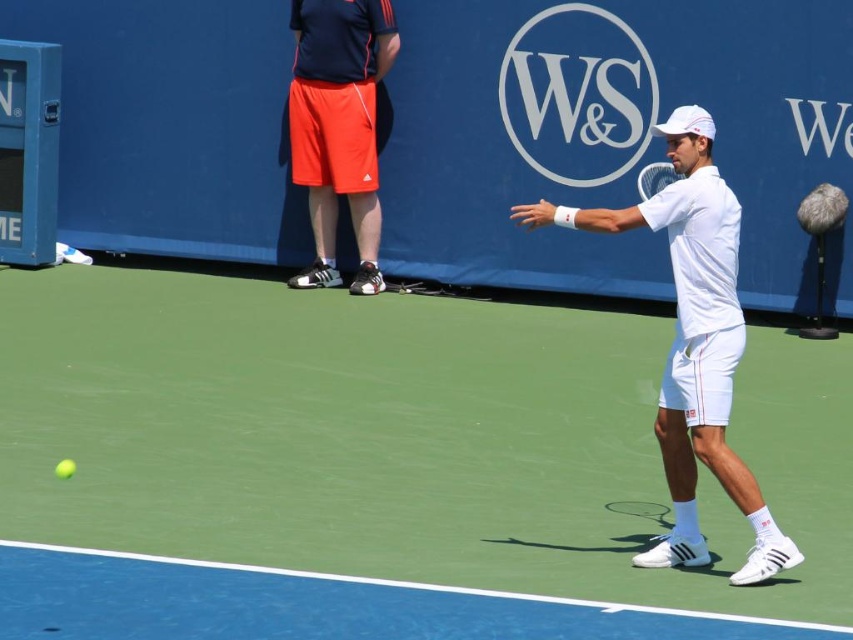
You are a tennis coach observing the match and want to analyze the players. Which racket is taller, the white matte tennis racket at right or the white matte tennis racket at center?

The white matte tennis racket at right is taller than the white matte tennis racket at center according to the description.